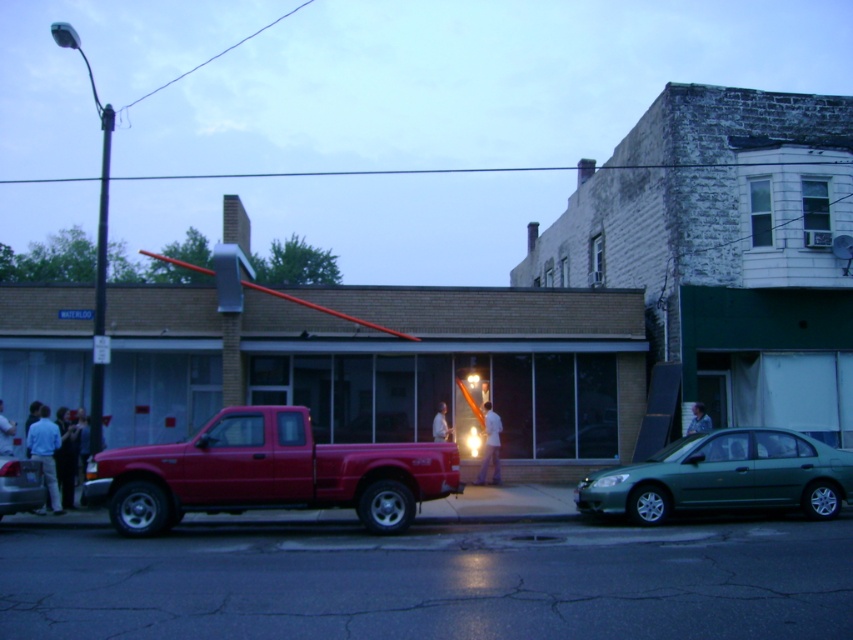
Question: Which is farther from the white matte shirt at center?

Choices:
 (A) metallic silver car at lower left
 (B) light blue shirt at lower left
 (C) camouflage shirt at center
 (D) metallic pole at left

Answer: (D)

Question: Considering the relative positions of metallic silver car at lower left and light blue shirt at lower left in the image provided, where is metallic silver car at lower left located with respect to light blue shirt at lower left?

Choices:
 (A) above
 (B) below

Answer: (B)

Question: Is metallic silver car at lower left bigger than light blue shirt at lower left?

Choices:
 (A) yes
 (B) no

Answer: (A)

Question: Which of these objects is positioned closest to the light blue shirt at left?

Choices:
 (A) white fabric shirt at center
 (B) green metallic sedan at lower right
 (C) camouflage shirt at center
 (D) matte red truck at center

Answer: (D)

Question: Considering the relative positions of white matte shirt at center and light blue shirt at lower left in the image provided, where is white matte shirt at center located with respect to light blue shirt at lower left?

Choices:
 (A) left
 (B) right

Answer: (B)

Question: Which of the following is the closest to the observer?

Choices:
 (A) (109, 116)
 (B) (433, 433)
 (C) (3, 452)

Answer: (C)